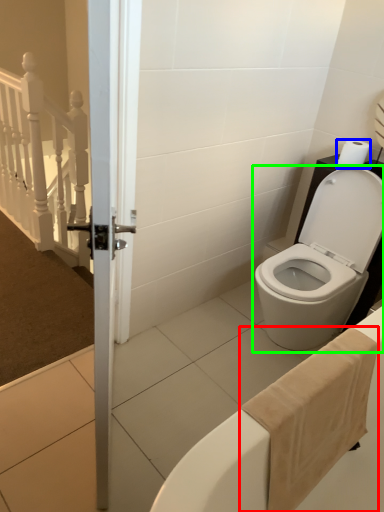
Question: Which is farther away from bath towel (highlighted by a red box)? toilet paper (highlighted by a blue box) or toilet (highlighted by a green box)?

Choices:
 (A) toilet paper
 (B) toilet

Answer: (A)